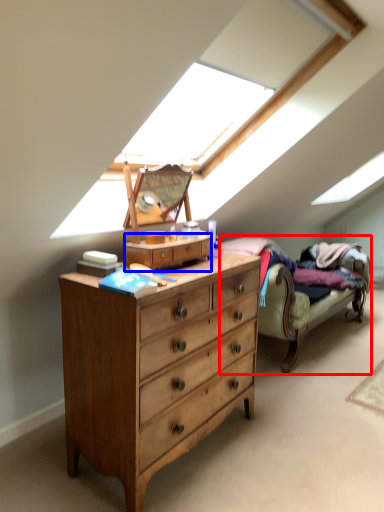
Question: Among these objects, which one is farthest to the camera, studio couch (highlighted by a red box) or file cabinet (highlighted by a blue box)?

Choices:
 (A) studio couch
 (B) file cabinet

Answer: (A)